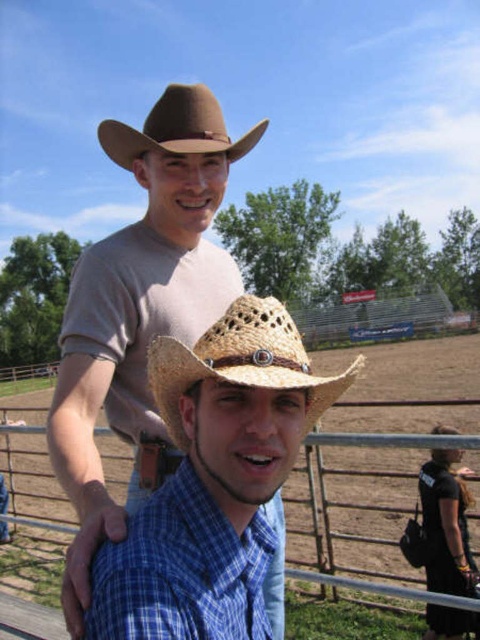
Is woven straw hat at center positioned at the back of brown felt cowboy hat at upper center?

No, it is not.

Based on the photo, can you confirm if woven straw hat at center is positioned above brown felt cowboy hat at upper center?

Incorrect, woven straw hat at center is not positioned above brown felt cowboy hat at upper center.

Which is behind, point (321, 397) or point (127, 152)?

The point (127, 152) is behind.

At what (x,y) coordinates should I click in order to perform the action: click on woven straw hat at center. Please return your answer as a coordinate pair (x, y). This screenshot has height=640, width=480. Looking at the image, I should click on (241, 362).

Between brown felt cowboy hat at upper center and metallic wire fence at lower center, which one has more height?

Standing taller between the two is brown felt cowboy hat at upper center.

What do you see at coordinates (177, 129) in the screenshot?
I see `brown felt cowboy hat at upper center` at bounding box center [177, 129].

Image resolution: width=480 pixels, height=640 pixels. I want to click on brown felt cowboy hat at upper center, so click(177, 129).

Does blue plaid shirt at center have a smaller size compared to woven straw hat at center?

Indeed, blue plaid shirt at center has a smaller size compared to woven straw hat at center.

Is blue plaid shirt at center above woven straw hat at center?

No.

Is point (104, 625) positioned before point (170, 381)?

Yes.

This screenshot has height=640, width=480. I want to click on blue plaid shirt at center, so click(189, 570).